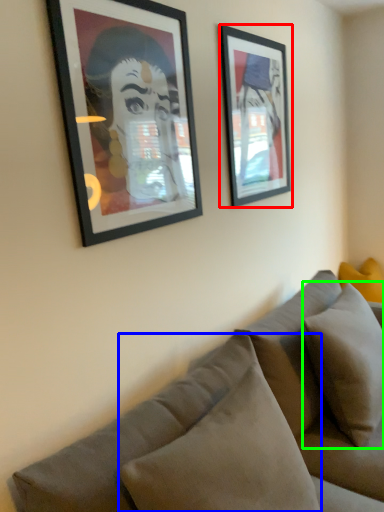
Question: Based on their relative distances, which object is nearer to picture frame (highlighted by a red box)? Choose from pillow (highlighted by a blue box) and pillow (highlighted by a green box).

Choices:
 (A) pillow
 (B) pillow

Answer: (B)